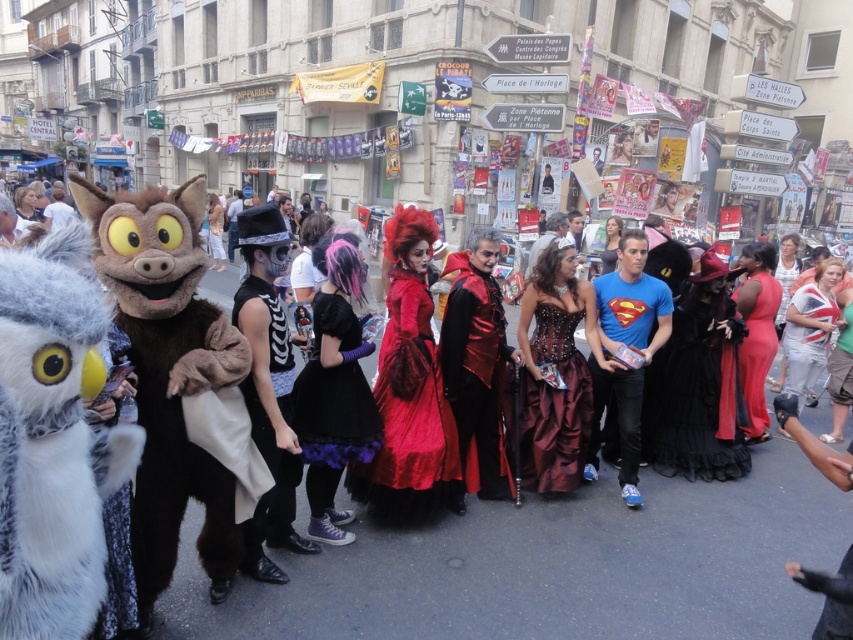
In the scene shown: Who is taller, white furry owl at left or black velvet dress at center?

With more height is black velvet dress at center.

What do you see at coordinates (53, 440) in the screenshot? The width and height of the screenshot is (853, 640). I see `white furry owl at left` at bounding box center [53, 440].

The height and width of the screenshot is (640, 853). What do you see at coordinates (53, 440) in the screenshot?
I see `white furry owl at left` at bounding box center [53, 440].

Locate an element on the screen. The image size is (853, 640). white furry owl at left is located at coordinates (53, 440).

Can you confirm if black leather vest at center is positioned below velvet black dress at center?

Correct, black leather vest at center is located below velvet black dress at center.

Does black leather vest at center have a lesser width compared to velvet black dress at center?

Yes, black leather vest at center is thinner than velvet black dress at center.

This screenshot has height=640, width=853. Identify the location of black leather vest at center. (268, 388).

Is black velvet dress at center positioned before velvet red dress at center?

That is False.

Does black velvet dress at center appear on the left side of velvet red dress at center?

No, black velvet dress at center is not to the left of velvet red dress at center.

Find the location of a particular element. black velvet dress at center is located at coordinates (698, 385).